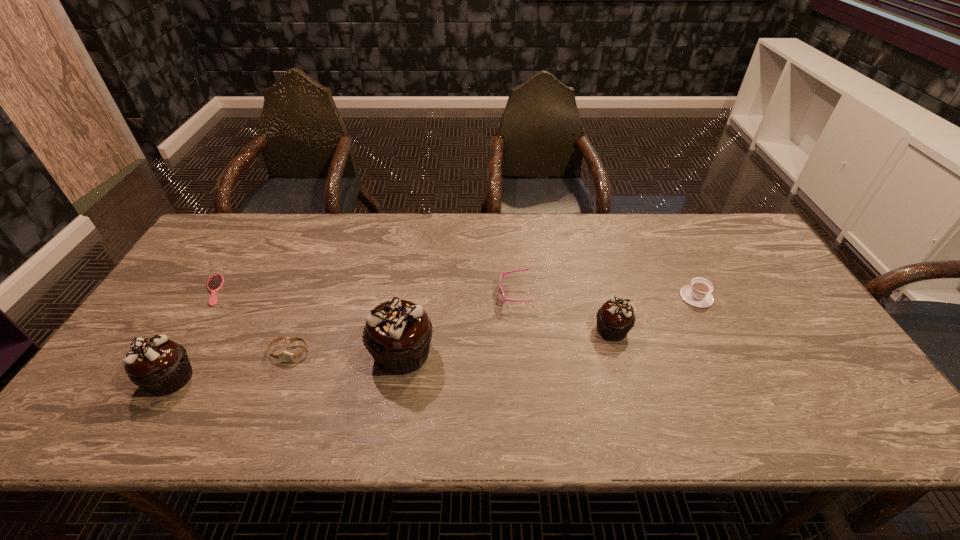
Point out which object is positioned as the fifth nearest to the leftmost cupcake. Please provide its 2D coordinates. Your answer should be formatted as a tuple, i.e. [(x, y)], where the tuple contains the x and y coordinates of a point satisfying the conditions above.

[(615, 318)]

Find the location of a particular element. the third closest cupcake to the rightmost object is located at coordinates (160, 366).

Identify the location of cupcake that can be found as the second closest to the hairbrush. The height and width of the screenshot is (540, 960). (397, 333).

At what (x,y) coordinates should I click in order to perform the action: click on free space that satisfies the following two spatial constraints: 1. on the back side of the rightmost cupcake; 2. on the left side of the tallest object. Please return your answer as a coordinate pair (x, y). Looking at the image, I should click on (405, 330).

Identify the location of free region that satisfies the following two spatial constraints: 1. on the front-facing side of the sunglasses; 2. on the face of the fifth object from right to left. (518, 353).

You are a GUI agent. You are given a task and a screenshot of the screen. Output one action in this format:
    pyautogui.click(x=<x>, y=<y>)
    Task: Click on the free location that satisfies the following two spatial constraints: 1. on the front side of the fifth shortest object; 2. on the left side of the hairbrush
    This screenshot has width=960, height=540.
    Given the screenshot: What is the action you would take?
    pyautogui.click(x=189, y=330)

The image size is (960, 540). In order to click on vacant area that satisfies the following two spatial constraints: 1. on the front-facing side of the rightmost cupcake; 2. on the left side of the third object from right to left in this screenshot , I will do `click(516, 330)`.

Image resolution: width=960 pixels, height=540 pixels. What are the coordinates of `vacant area that satisfies the following two spatial constraints: 1. on the front side of the tallest object; 2. on the left side of the shortest object` in the screenshot? It's located at (175, 353).